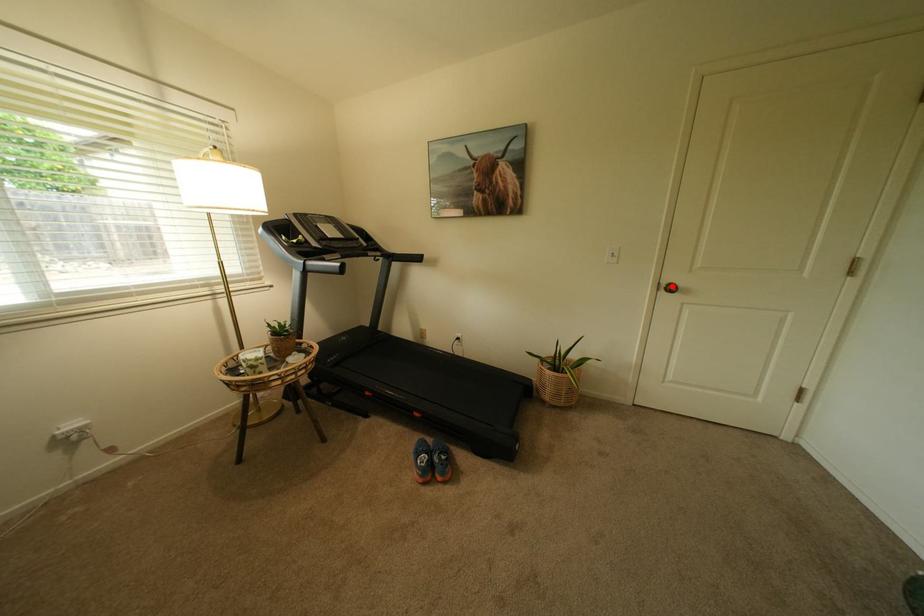
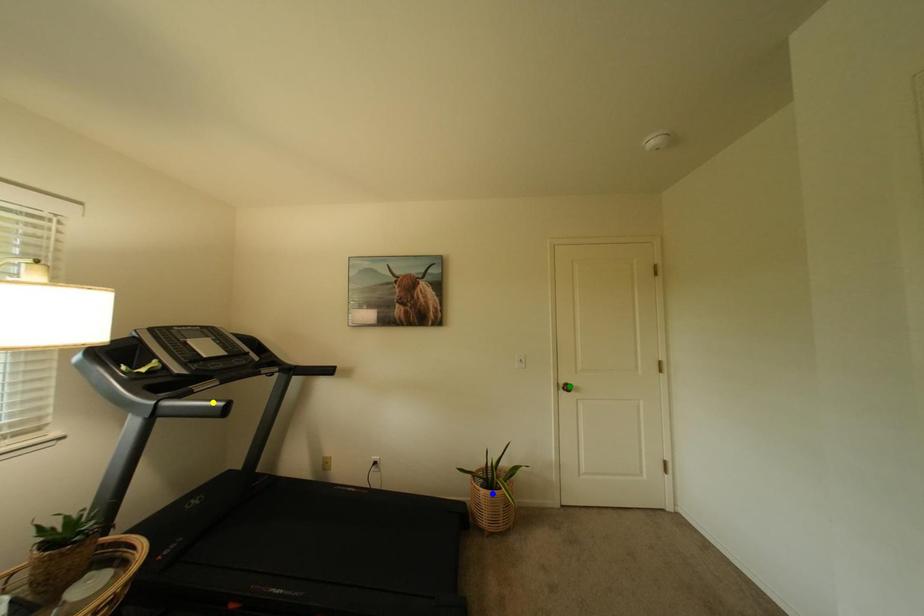
Question: I am providing you with two images of the same scene from different viewpoints. A red point is marked on the first image. You are given multiple points on the second image. Can you choose the point in image 2 that corresponds to the point in image 1?

Choices:
 (A) blue point
 (B) yellow point
 (C) green point

Answer: (C)